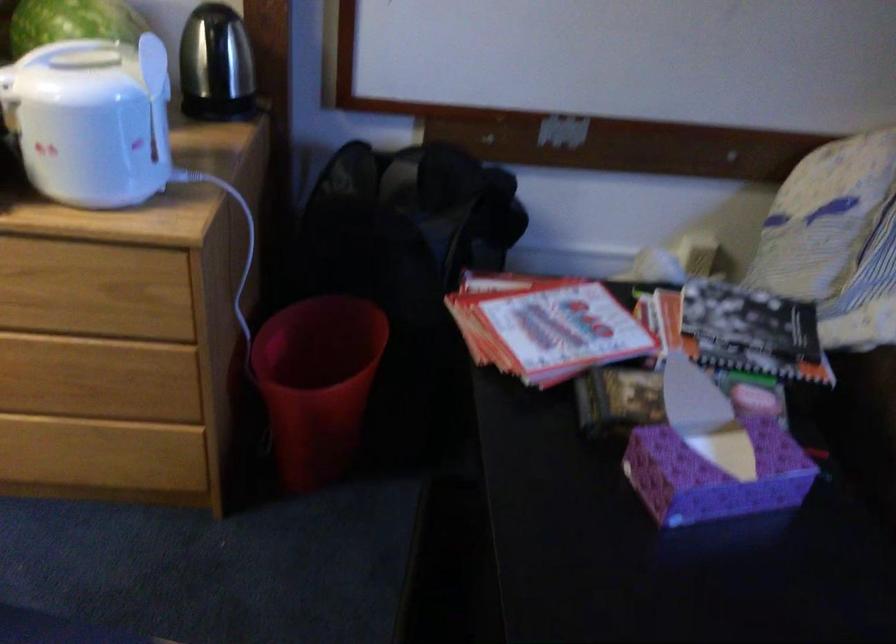
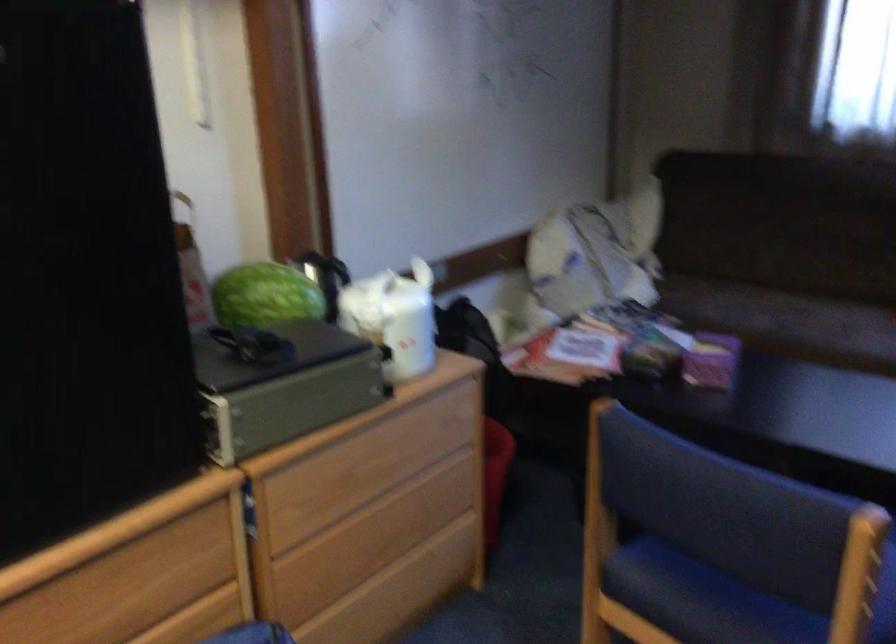
Question: I am providing you with two images of the same scene from different viewpoints. After the viewpoint changes to image2, which objects are now occluded?

Choices:
 (A) silver case latch
 (B) chair armrest
 (C) black food container
 (D) red trash can

Answer: (D)